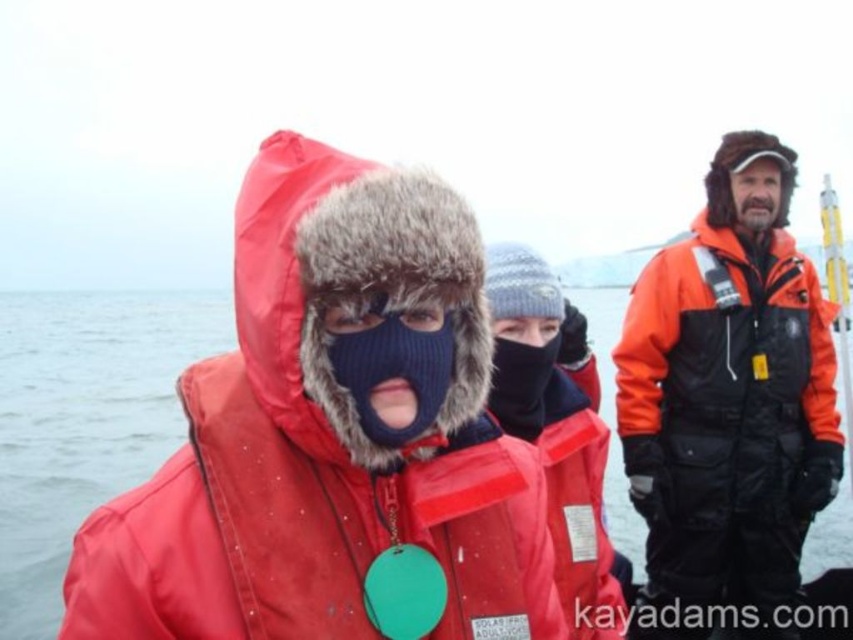
In order to click on knitted dark blue mask at center in this screenshot , I will do `click(393, 371)`.

Measure the distance between point (x=352, y=371) and camera.

They are 4.56 meters apart.

At what (x,y) coordinates should I click in order to perform the action: click on knitted dark blue mask at center. Please return your answer as a coordinate pair (x, y). Looking at the image, I should click on (393, 371).

Based on the photo, does orange synthetic jacket at center appear on the right side of green plastic medal at center?

Yes, orange synthetic jacket at center is to the right of green plastic medal at center.

Does orange synthetic jacket at center have a larger size compared to green plastic medal at center?

Yes.

What do you see at coordinates (727, 412) in the screenshot?
I see `orange synthetic jacket at center` at bounding box center [727, 412].

Image resolution: width=853 pixels, height=640 pixels. I want to click on orange synthetic jacket at center, so click(x=727, y=412).

Between knitted dark blue mask at center and black knit mask at center, which one is positioned higher?

Positioned higher is knitted dark blue mask at center.

Between knitted dark blue mask at center and black knit mask at center, which one has less height?

With less height is knitted dark blue mask at center.

Which is in front, point (375, 344) or point (497, 339)?

Point (375, 344) is more forward.

What are the coordinates of `knitted dark blue mask at center` in the screenshot? It's located at (393, 371).